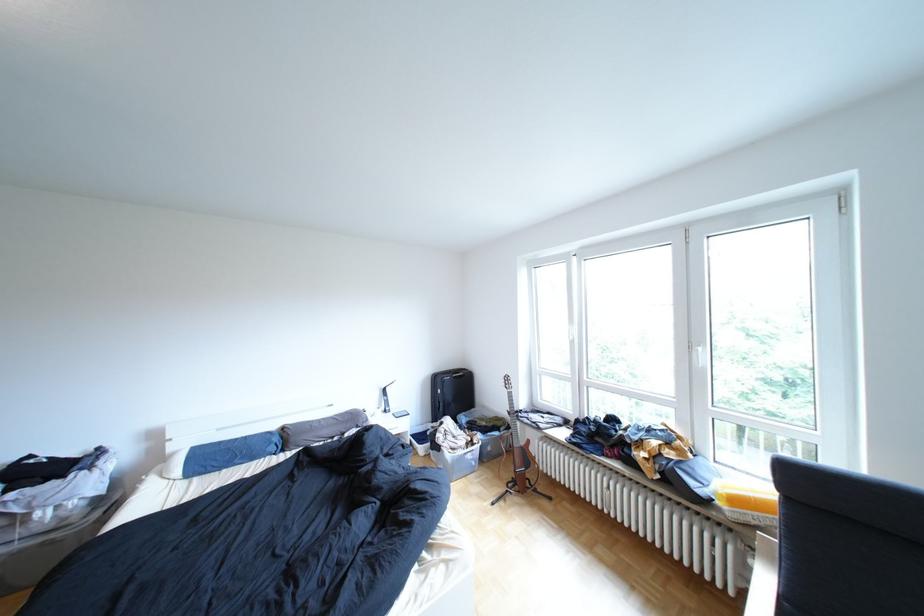
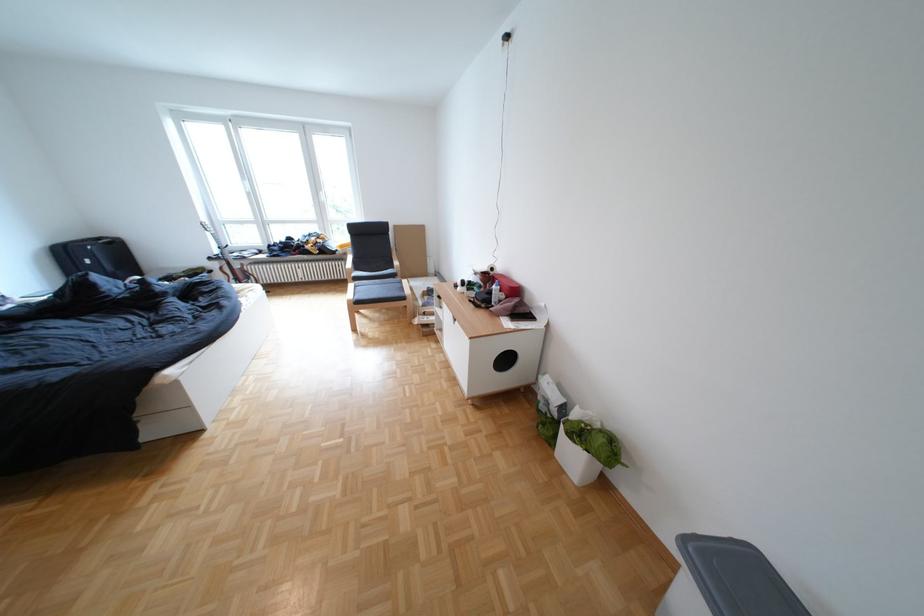
Find the pixel in the second image that matches point (477, 377) in the first image.

(126, 244)